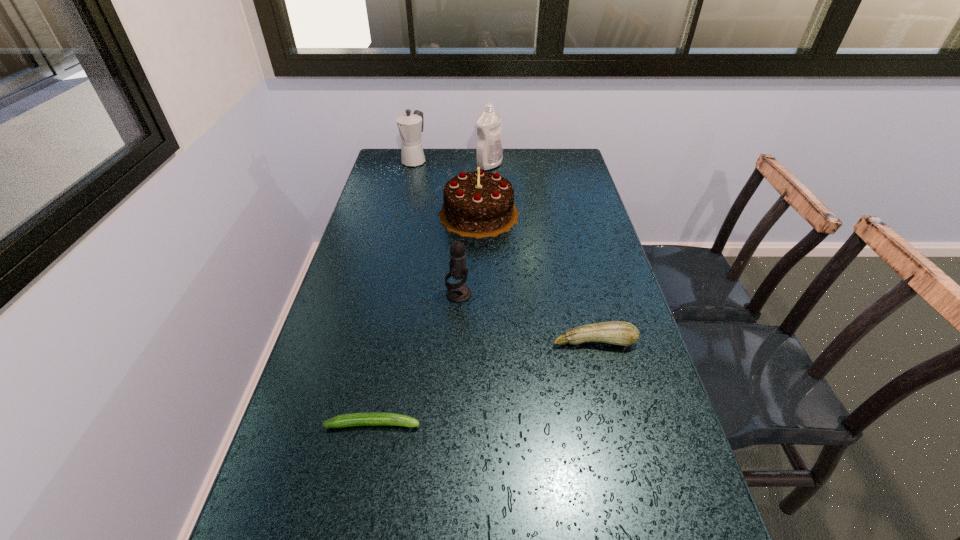
Where is `blank space located on the right of the fourth nearest object`? blank space located on the right of the fourth nearest object is located at coordinates (564, 214).

At what (x,y) coordinates should I click in order to perform the action: click on vacant space positioned 0.320m on the right of the fourth farthest object. Please return your answer as a coordinate pair (x, y). This screenshot has width=960, height=540. Looking at the image, I should click on (591, 294).

At what (x,y) coordinates should I click in order to perform the action: click on vacant position located at the stem end of the fifth farthest object. Please return your answer as a coordinate pair (x, y). Looking at the image, I should click on (631, 491).

At what (x,y) coordinates should I click in order to perform the action: click on vacant region located 0.060m on the front-facing side of the shortest object. Please return your answer as a coordinate pair (x, y). Image resolution: width=960 pixels, height=540 pixels. Looking at the image, I should click on (450, 424).

This screenshot has height=540, width=960. I want to click on detergent that is at the far edge, so click(x=489, y=153).

Identify the location of coffeepot that is at the far edge. (410, 126).

The width and height of the screenshot is (960, 540). I want to click on coffeepot at the left edge, so click(x=410, y=126).

Find the location of `zucchini present at the left edge`. zucchini present at the left edge is located at coordinates (366, 418).

Locate an element on the screen. The image size is (960, 540). object present at the right edge is located at coordinates (622, 333).

Locate an element on the screen. object that is at the far left corner is located at coordinates (410, 126).